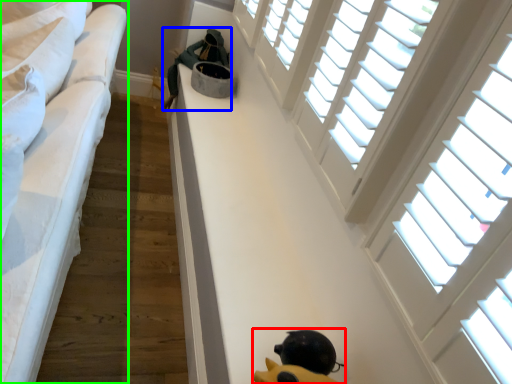
Question: Which object is positioned closest to toy (highlighted by a red box)? Select from person (highlighted by a blue box) and furniture (highlighted by a green box).

Choices:
 (A) person
 (B) furniture

Answer: (B)